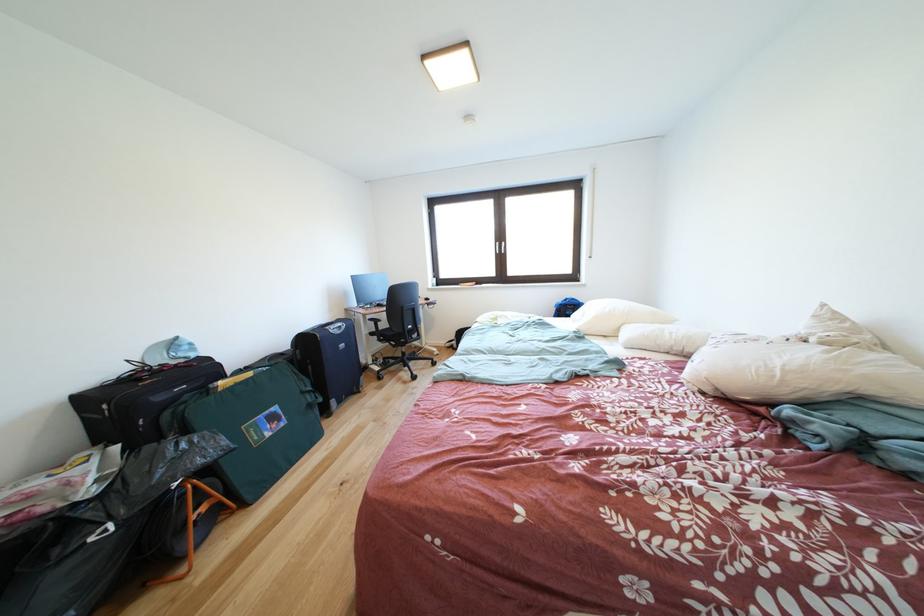
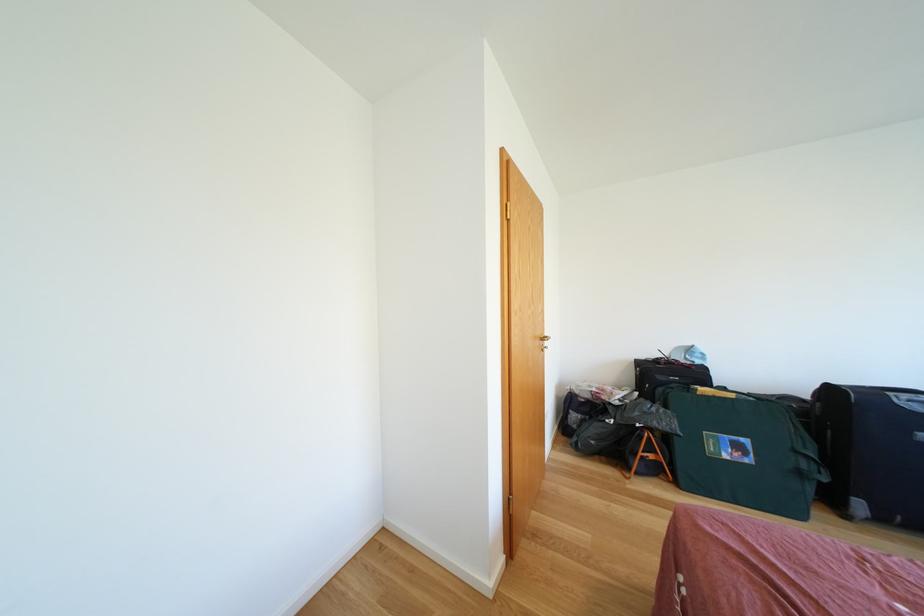
Question: Based on the continuous images, in which direction is the camera rotating? Reply with the corresponding letter.

Choices:
 (A) Left
 (B) Right
 (C) Up
 (D) Down

Answer: (A)